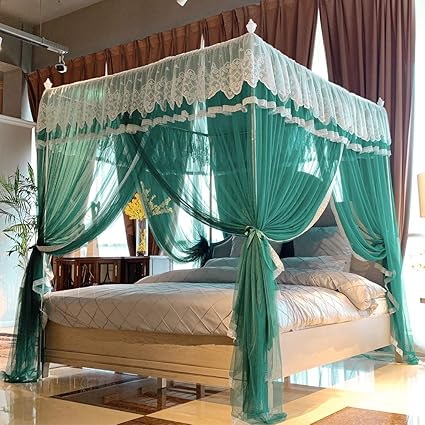
Locate an element on the screen. bed frame is located at coordinates (312, 352).